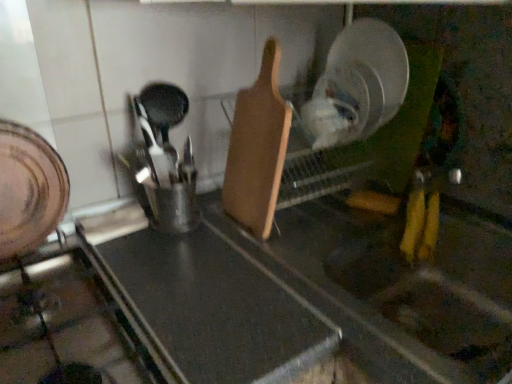
Question: From their relative heights in the image, would you say black matte cutting board at center is taller or shorter than wooden cutting board at center?

Choices:
 (A) tall
 (B) short

Answer: (A)

Question: Is black matte cutting board at center in front of or behind wooden cutting board at center in the image?

Choices:
 (A) behind
 (B) front

Answer: (B)

Question: Which of these objects is positioned closest to the black matte cutting board at center?

Choices:
 (A) brushed metal gas stove at lower left
 (B) wooden cutting board at center

Answer: (A)

Question: Which object is the closest to the wooden cutting board at center?

Choices:
 (A) black matte cutting board at center
 (B) brushed metal gas stove at lower left

Answer: (A)